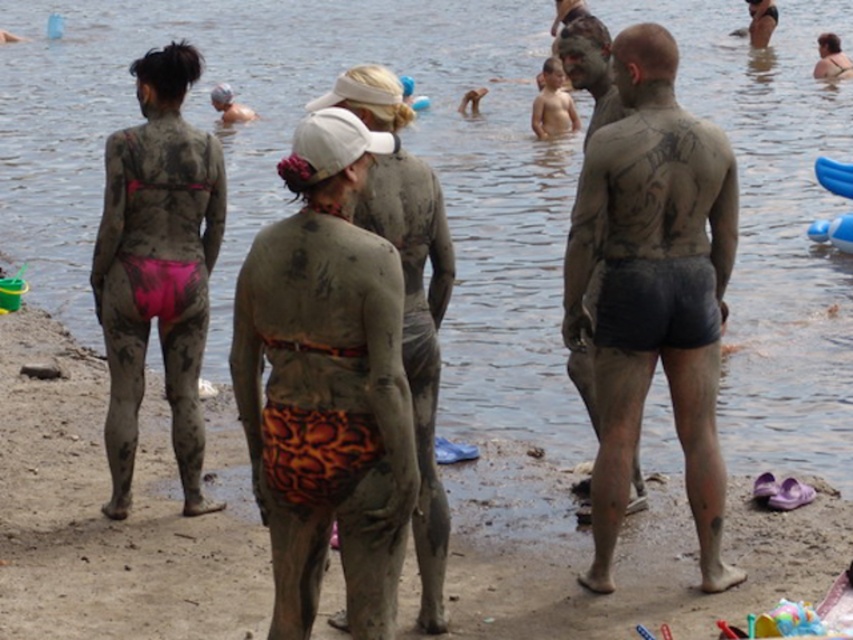
In the scene of a mud bath, there are two items of clothing visible. The first is a muddy pink bikini bottom at back left, and the second is orange textured shorts at center. From the perspective of someone facing the image, which of these two clothing items is positioned to the left?

The muddy pink bikini bottom at back left is positioned to the left of the orange textured shorts at center.

You are a photographer trying to capture a closeup shot of the orange textured shorts at center and the muddy skin man at center. Since your camera has a limited focus range, which object should you focus on to ensure it fills the frame more? Please explain your reasoning based on their sizes.

The orange textured shorts at center has a larger size compared to the muddy skin man at center. Therefore, to ensure it fills the frame more, you should focus on the orange textured shorts at center since it is bigger in size.

You are a photographer trying to capture a closeup of the orange textured shorts at center and the muddy skin man at center. Since you can only focus on one subject at a time, which one should you choose if you want to ensure the other is still partially visible in the frame?

You should focus on the orange textured shorts at center because it is to the left of the muddy skin man at center, so keeping it in focus will still allow the muddy skin man at center to be partially visible in the frame.